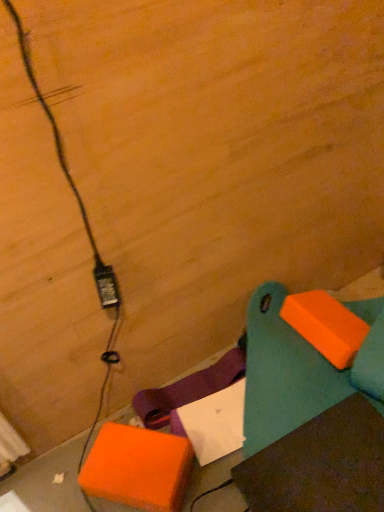
Question: From a real-world perspective, is black plastic power plug at lower left positioned under orange matte cardboard box at lower left based on gravity?

Choices:
 (A) yes
 (B) no

Answer: (B)

Question: Is black plastic power plug at lower left thinner than orange matte cardboard box at lower left?

Choices:
 (A) no
 (B) yes

Answer: (B)

Question: Is black plastic power plug at lower left to the right of orange matte cardboard box at lower left from the viewer's perspective?

Choices:
 (A) yes
 (B) no

Answer: (B)

Question: Can you confirm if black plastic power plug at lower left is bigger than orange matte cardboard box at lower left?

Choices:
 (A) no
 (B) yes

Answer: (A)

Question: Does black plastic power plug at lower left touch orange matte cardboard box at lower left?

Choices:
 (A) yes
 (B) no

Answer: (B)

Question: Is point (155, 458) closer or farther from the camera than point (102, 270)?

Choices:
 (A) farther
 (B) closer

Answer: (A)

Question: Considering the positions of orange matte cardboard box at lower left and black plastic power plug at lower left in the image, is orange matte cardboard box at lower left taller or shorter than black plastic power plug at lower left?

Choices:
 (A) short
 (B) tall

Answer: (A)

Question: Is orange matte cardboard box at lower left in front of or behind black plastic power plug at lower left in the image?

Choices:
 (A) front
 (B) behind

Answer: (B)

Question: Is orange matte cardboard box at lower left situated inside black plastic power plug at lower left or outside?

Choices:
 (A) outside
 (B) inside

Answer: (A)

Question: In terms of size, does teal plastic bench at lower right appear bigger or smaller than orange matte cardboard box at lower left?

Choices:
 (A) big
 (B) small

Answer: (A)

Question: In the image, is teal plastic bench at lower right positioned in front of or behind orange matte cardboard box at lower left?

Choices:
 (A) front
 (B) behind

Answer: (A)

Question: From the image's perspective, is teal plastic bench at lower right located above or below orange matte cardboard box at lower left?

Choices:
 (A) below
 (B) above

Answer: (B)

Question: In terms of height, does teal plastic bench at lower right look taller or shorter compared to orange matte cardboard box at lower left?

Choices:
 (A) tall
 (B) short

Answer: (A)

Question: From the image's perspective, relative to black plastic power plug at lower left, is teal plastic bench at lower right above or below?

Choices:
 (A) below
 (B) above

Answer: (A)

Question: In terms of width, does teal plastic bench at lower right look wider or thinner when compared to black plastic power plug at lower left?

Choices:
 (A) wide
 (B) thin

Answer: (A)